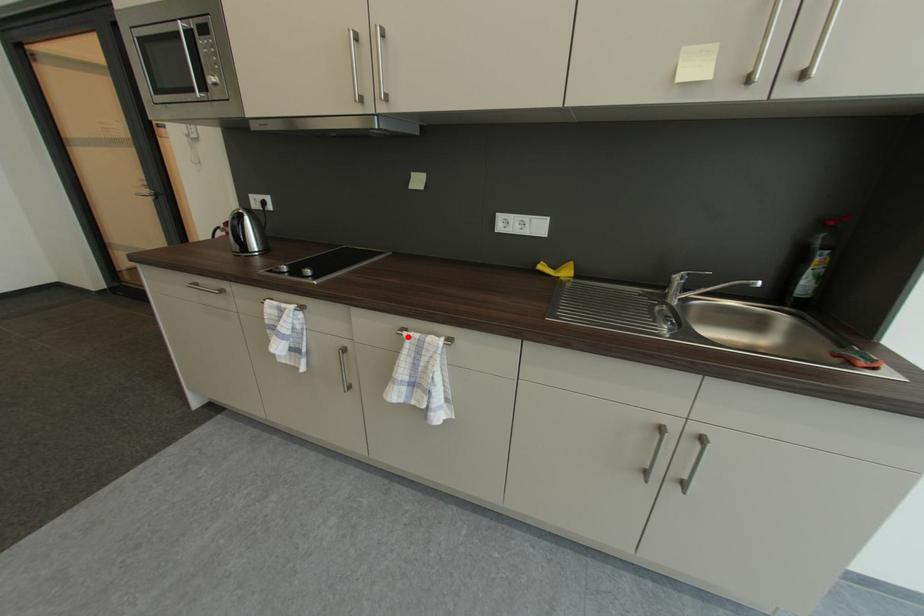
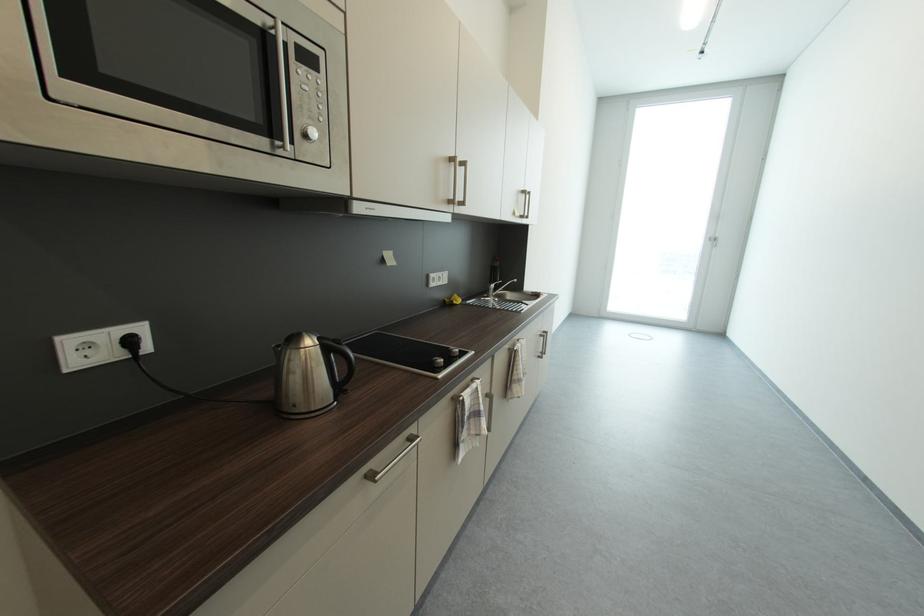
The point at the highlighted location is marked in the first image. Where is the corresponding point in the second image?

(523, 351)